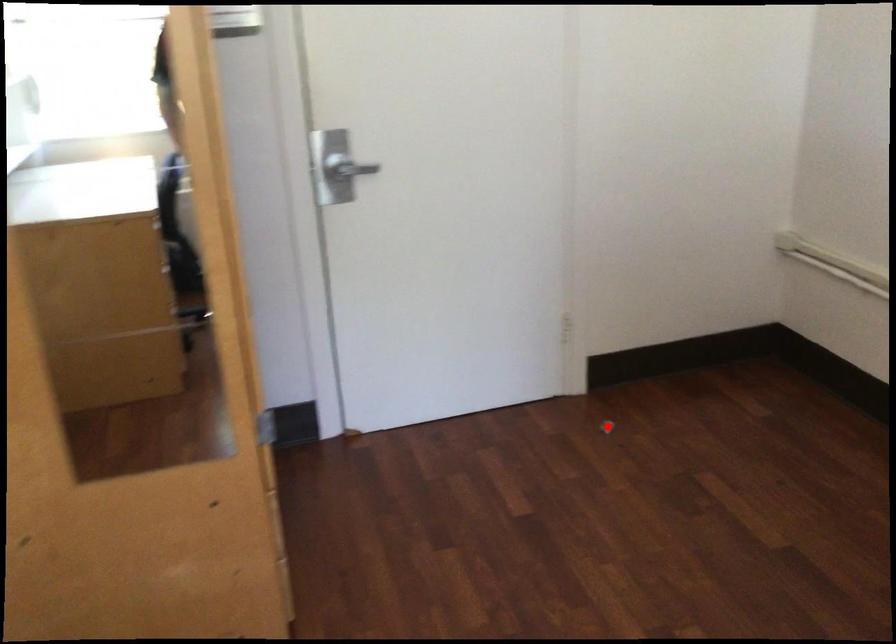
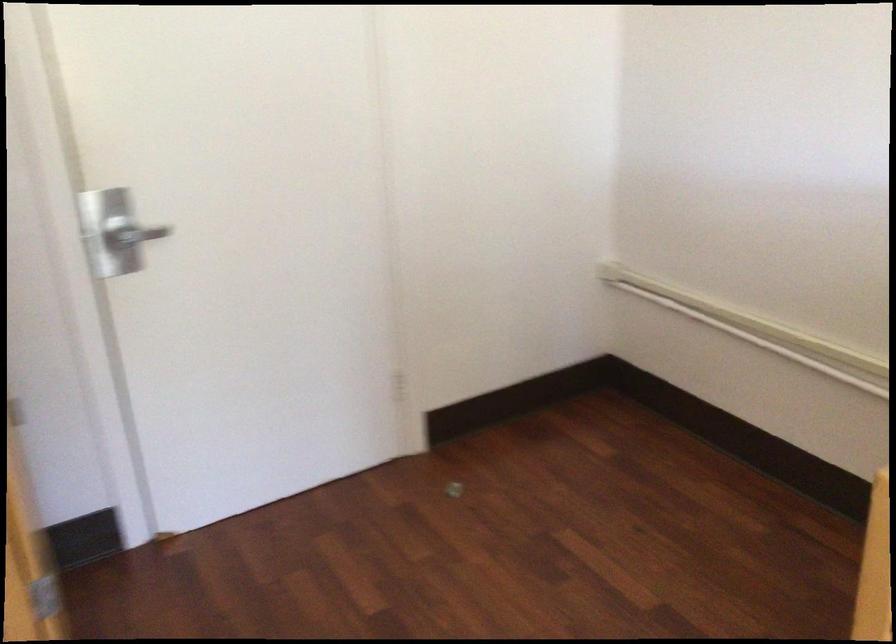
In the second image, find the point that corresponds to the highlighted location in the first image.

(453, 489)